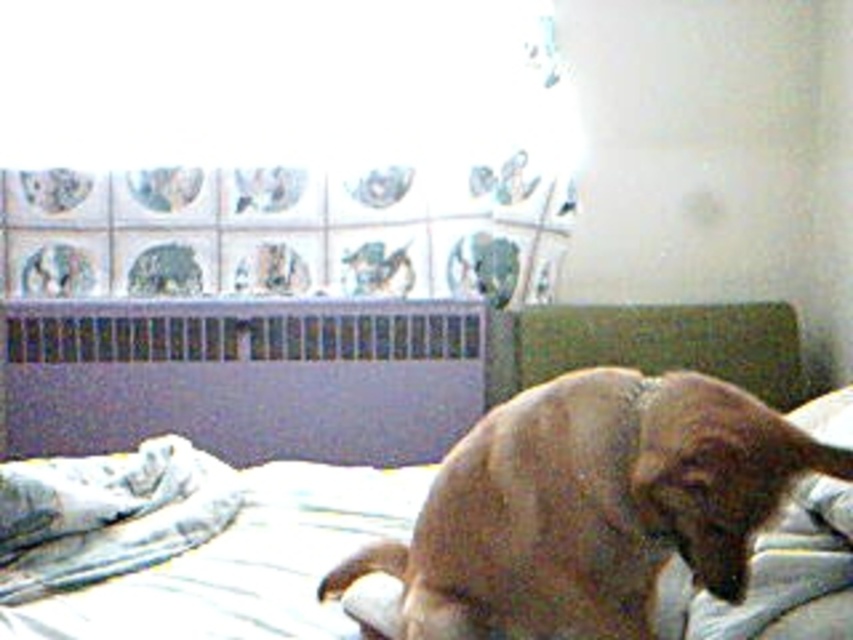
You are standing in the bedroom and want to know which of the two points, point (776, 504) or point (212, 474), is nearer to you. Based on the scene, which point is closer?

Point (776, 504) is closer to the camera than point (212, 474), so it is the closer one.

Based on the coordinates provided, which object in the scene is located at point (x=585, y=509)?

The point (x=585, y=509) corresponds to the brown furry dog at center.

You are a photographer setting up a shoot in this bedroom. You need to decide whether to place a small tripod between the brown furry dog at center and the white soft blanket at lower left. Since the tripod requires 30 cm of vertical space, can you confirm if there is enough height between these two items?

The brown furry dog at center has a greater height compared to the white soft blanket at lower left. However, the exact heights of both objects are not provided, so it is uncertain if the vertical space between them is sufficient for the tripod requiring 30 cm.